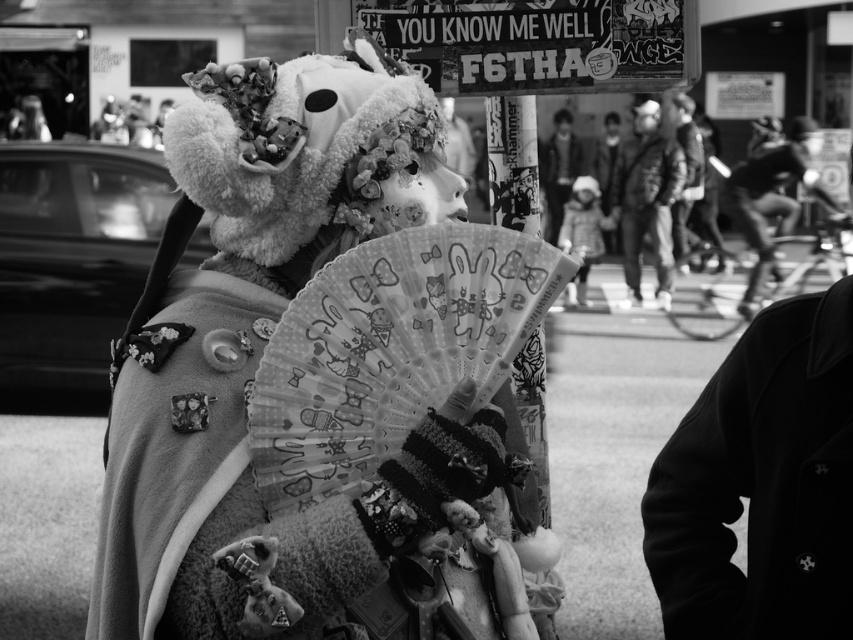
Is fluffy white teddy bear at center below dark gray jacket at center?

Correct, fluffy white teddy bear at center is located below dark gray jacket at center.

How much distance is there between fluffy white teddy bear at center and dark gray jacket at center?

A distance of 15.74 meters exists between fluffy white teddy bear at center and dark gray jacket at center.

Locate an element on the screen. Image resolution: width=853 pixels, height=640 pixels. fluffy white teddy bear at center is located at coordinates (259, 358).

The width and height of the screenshot is (853, 640). I want to click on fluffy white teddy bear at center, so click(x=259, y=358).